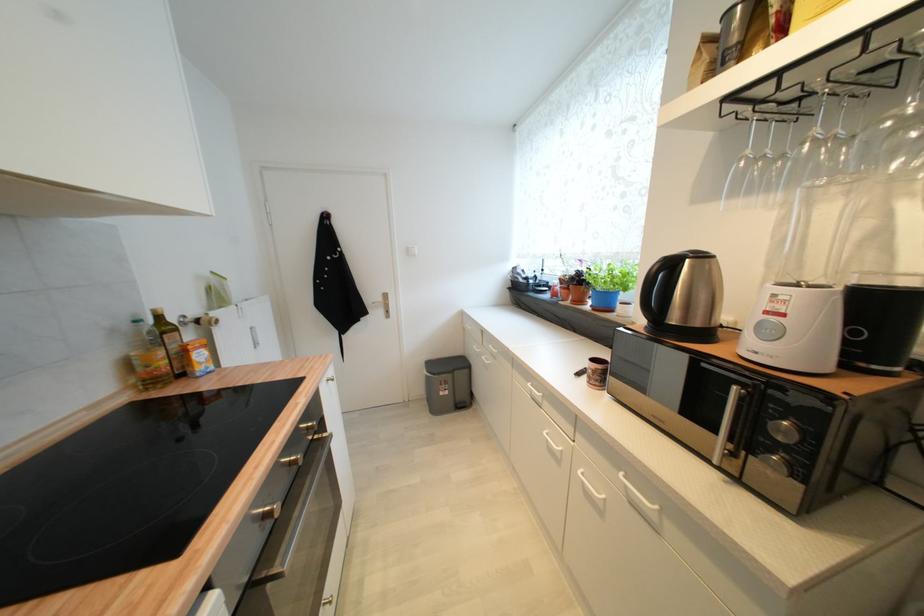
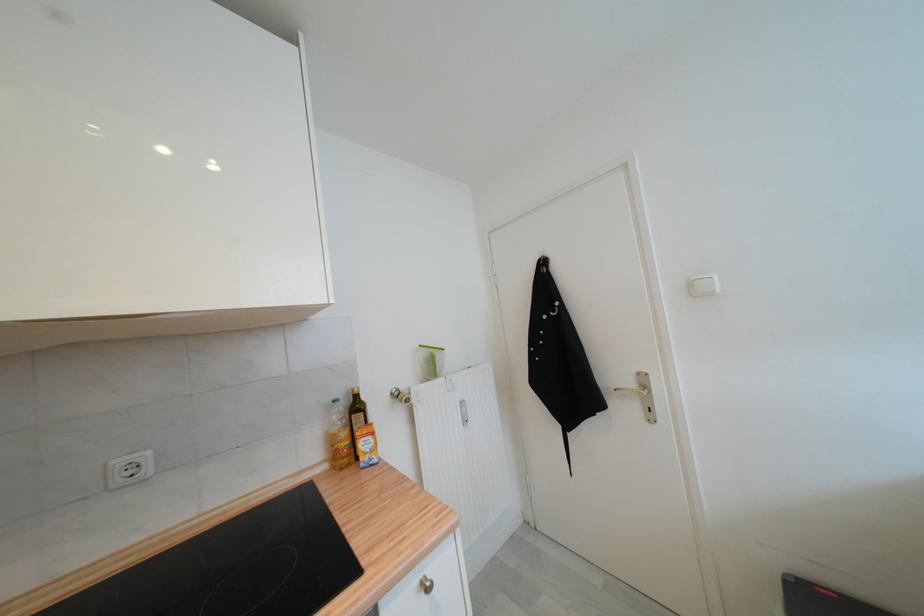
In the second image, find the point that corresponds to [385,301] in the first image.

(637, 386)